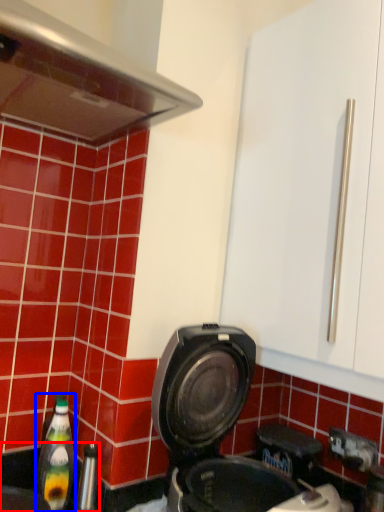
Question: Which object is further to the camera taking this photo, sink (highlighted by a red box) or bottle (highlighted by a blue box)?

Choices:
 (A) sink
 (B) bottle

Answer: (B)